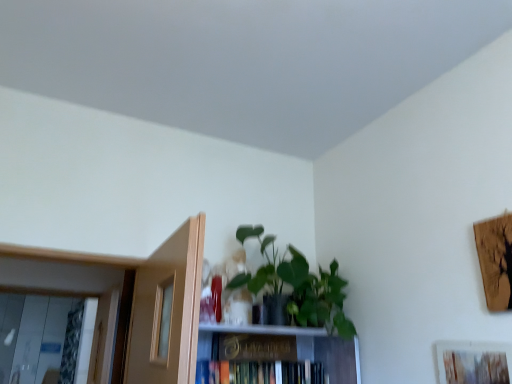
Question: Can you confirm if green matte plant at upper center is thinner than hardcover book at center?

Choices:
 (A) yes
 (B) no

Answer: (B)

Question: From the image's perspective, is green matte plant at upper center below hardcover book at center?

Choices:
 (A) yes
 (B) no

Answer: (B)

Question: Is green matte plant at upper center next to hardcover book at center?

Choices:
 (A) yes
 (B) no

Answer: (B)

Question: Considering the relative sizes of green matte plant at upper center and hardcover book at center in the image provided, is green matte plant at upper center wider than hardcover book at center?

Choices:
 (A) no
 (B) yes

Answer: (B)

Question: Is hardcover book at center a part of green matte plant at upper center?

Choices:
 (A) yes
 (B) no

Answer: (B)

Question: Is hardcover book at center in front of or behind green matte plant at upper center in the image?

Choices:
 (A) front
 (B) behind

Answer: (B)

Question: From the image's perspective, relative to green matte plant at upper center, is hardcover book at center above or below?

Choices:
 (A) below
 (B) above

Answer: (A)

Question: Is point [258, 377] closer or farther from the camera than point [304, 319]?

Choices:
 (A) farther
 (B) closer

Answer: (A)

Question: From a real-world perspective, is hardcover book at center physically located above or below green matte plant at upper center?

Choices:
 (A) above
 (B) below

Answer: (B)

Question: From a real-world perspective, is green matte plant at upper center positioned above or below gold metallic paperback book at center?

Choices:
 (A) above
 (B) below

Answer: (A)

Question: Would you say green matte plant at upper center is to the left or to the right of gold metallic paperback book at center in the picture?

Choices:
 (A) left
 (B) right

Answer: (B)

Question: In terms of width, does green matte plant at upper center look wider or thinner when compared to gold metallic paperback book at center?

Choices:
 (A) thin
 (B) wide

Answer: (B)

Question: Relative to gold metallic paperback book at center, is green matte plant at upper center in front or behind?

Choices:
 (A) behind
 (B) front

Answer: (B)

Question: From a real-world perspective, is wooden textured picture frame at lower right physically located above or below green matte plant at upper center?

Choices:
 (A) below
 (B) above

Answer: (A)

Question: From their relative heights in the image, would you say wooden textured picture frame at lower right is taller or shorter than green matte plant at upper center?

Choices:
 (A) short
 (B) tall

Answer: (A)